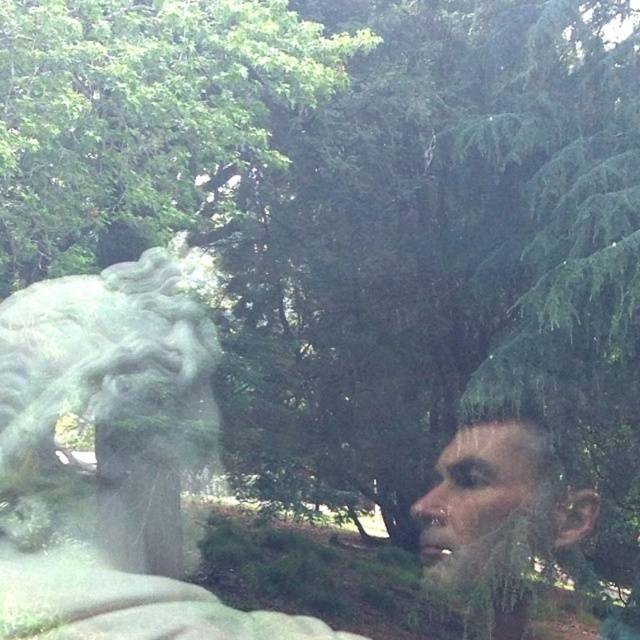
Question: Is gray stone lion at left wider than smooth skin face at center?

Choices:
 (A) no
 (B) yes

Answer: (B)

Question: Which object is farther from the camera taking this photo?

Choices:
 (A) gray stone lion at left
 (B) smooth skin face at center

Answer: (B)

Question: Is green leafy tree at upper center positioned at the back of gray stone lion at left?

Choices:
 (A) yes
 (B) no

Answer: (B)

Question: Which object is farther from the camera taking this photo?

Choices:
 (A) gray stone lion at left
 (B) smooth skin face at center

Answer: (B)

Question: Estimate the real-world distances between objects in this image. Which object is closer to the gray stone lion at left?

Choices:
 (A) smooth skin face at center
 (B) green leafy tree at upper center

Answer: (B)

Question: Can you confirm if green leafy tree at upper center is smaller than smooth skin face at center?

Choices:
 (A) yes
 (B) no

Answer: (B)